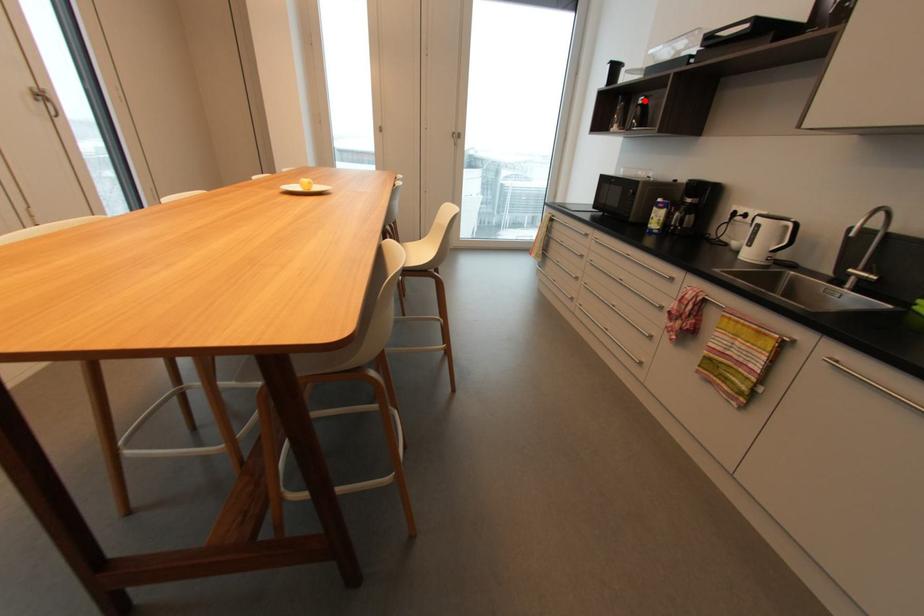
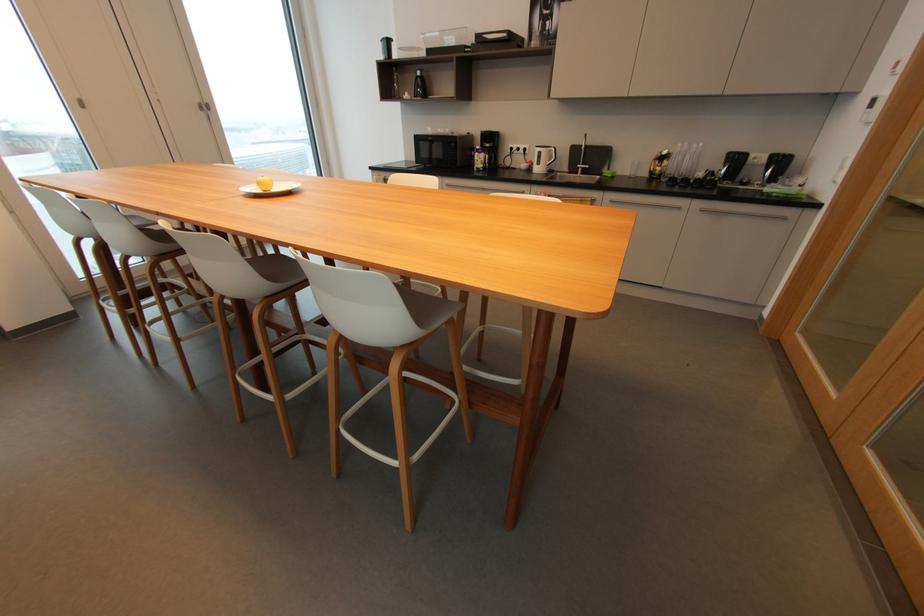
Where in the second image is the point corresponding to the highlighted location from the first image?

(421, 74)